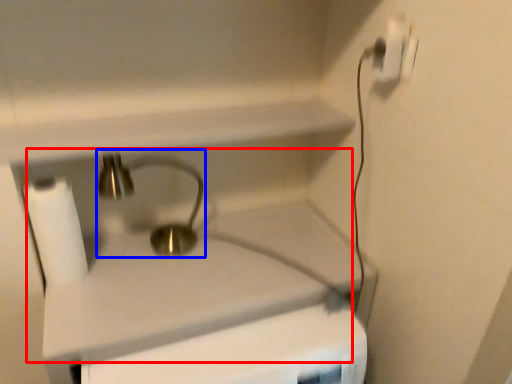
Question: Which point is closer to the camera, sink (highlighted by a red box) or faucet (highlighted by a blue box)?

Choices:
 (A) sink
 (B) faucet

Answer: (A)